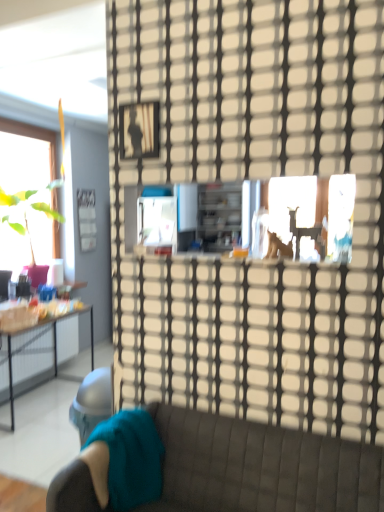
The height and width of the screenshot is (512, 384). Describe the element at coordinates (255, 178) in the screenshot. I see `transparent glass door at center` at that location.

Where is `velvet teal studio couch at lower left`? This screenshot has width=384, height=512. velvet teal studio couch at lower left is located at coordinates (260, 467).

At what (x,y) coordinates should I click in order to perform the action: click on teal fabric pillow at lower left. Please return your answer as a coordinate pair (x, y). The height and width of the screenshot is (512, 384). Looking at the image, I should click on (125, 460).

Is transparent glass door at center oriented towards velvet teal studio couch at lower left?

No, transparent glass door at center does not turn towards velvet teal studio couch at lower left.

Is transparent glass door at center in contact with velvet teal studio couch at lower left?

No, transparent glass door at center is not in contact with velvet teal studio couch at lower left.

Is point (195, 93) farther from camera compared to point (268, 459)?

Yes.

Is transparent glass door at center further to camera compared to velvet teal studio couch at lower left?

That is True.

From the image's perspective, which is above, velvet teal studio couch at lower left or teal fabric pillow at lower left?

From the image's view, teal fabric pillow at lower left is above.

Considering the sizes of objects velvet teal studio couch at lower left and teal fabric pillow at lower left in the image provided, who is bigger, velvet teal studio couch at lower left or teal fabric pillow at lower left?

velvet teal studio couch at lower left is bigger.

Between point (296, 510) and point (126, 416), which one is positioned behind?

The point (126, 416) is behind.

This screenshot has width=384, height=512. In order to click on studio couch lying on the right of teal fabric pillow at lower left in this screenshot , I will do `click(260, 467)`.

You are a GUI agent. You are given a task and a screenshot of the screen. Output one action in this format:
    pyautogui.click(x=<x>, y=<y>)
    Task: Click on the pillow on the left of metallic silver picture frame at upper center
    This screenshot has width=384, height=512.
    Given the screenshot: What is the action you would take?
    pyautogui.click(x=125, y=460)

Which is behind, point (159, 478) or point (139, 130)?

Positioned behind is point (139, 130).

From a real-world perspective, does teal fabric pillow at lower left sit lower than metallic silver picture frame at upper center?

Yes, from a real-world perspective, teal fabric pillow at lower left is below metallic silver picture frame at upper center.

From the image's perspective, is velvet teal studio couch at lower left on top of metallic silver picture frame at upper center?

No, from the image's perspective, velvet teal studio couch at lower left is not above metallic silver picture frame at upper center.

Is velvet teal studio couch at lower left wider or thinner than metallic silver picture frame at upper center?

Considering their sizes, velvet teal studio couch at lower left looks broader than metallic silver picture frame at upper center.

Is velvet teal studio couch at lower left looking in the opposite direction of metallic silver picture frame at upper center?

No, velvet teal studio couch at lower left's orientation is not away from metallic silver picture frame at upper center.

Considering the sizes of objects teal fabric pillow at lower left and velvet teal studio couch at lower left in the image provided, who is smaller, teal fabric pillow at lower left or velvet teal studio couch at lower left?

teal fabric pillow at lower left.

From the image's perspective, between teal fabric pillow at lower left and velvet teal studio couch at lower left, who is located below?

velvet teal studio couch at lower left appears lower in the image.

You are a GUI agent. You are given a task and a screenshot of the screen. Output one action in this format:
    pyautogui.click(x=<x>, y=<y>)
    Task: Click on the studio couch that appears in front of the teal fabric pillow at lower left
    
    Given the screenshot: What is the action you would take?
    pyautogui.click(x=260, y=467)

Can velvet teal studio couch at lower left be found inside teal fabric pillow at lower left?

No, velvet teal studio couch at lower left is not inside teal fabric pillow at lower left.

This screenshot has height=512, width=384. I want to click on pillow below the metallic silver picture frame at upper center (from the image's perspective), so click(125, 460).

Is metallic silver picture frame at upper center outside of teal fabric pillow at lower left?

Absolutely, metallic silver picture frame at upper center is external to teal fabric pillow at lower left.

Can you confirm if metallic silver picture frame at upper center is smaller than teal fabric pillow at lower left?

Indeed, metallic silver picture frame at upper center has a smaller size compared to teal fabric pillow at lower left.

Considering the points (127, 137) and (132, 455), which point is behind, point (127, 137) or point (132, 455)?

The point (127, 137) is behind.

Is point (150, 150) positioned in front of point (268, 112)?

No, it is behind (268, 112).

Is metallic silver picture frame at upper center placed right next to transparent glass door at center?

metallic silver picture frame at upper center is not next to transparent glass door at center, and they're not touching.

Considering the relative sizes of metallic silver picture frame at upper center and transparent glass door at center in the image provided, is metallic silver picture frame at upper center thinner than transparent glass door at center?

Correct, the width of metallic silver picture frame at upper center is less than that of transparent glass door at center.

In the scene shown: From a real-world perspective, which object rests below the other?

transparent glass door at center, from a real-world perspective.

I want to click on studio couch beneath the transparent glass door at center (from a real-world perspective), so click(x=260, y=467).

What are the coordinates of `studio couch in front of the teal fabric pillow at lower left` in the screenshot? It's located at (260, 467).

Based on the photo, estimate the real-world distances between objects in this image. Which object is further from teal fabric pillow at lower left, metallic silver picture frame at upper center or velvet teal studio couch at lower left?

metallic silver picture frame at upper center is positioned further to the anchor teal fabric pillow at lower left.

When comparing their distances from velvet teal studio couch at lower left, does teal fabric pillow at lower left or transparent glass door at center seem further?

Among the two, transparent glass door at center is located further to velvet teal studio couch at lower left.

Based on the photo, based on their spatial positions, is velvet teal studio couch at lower left or transparent glass door at center further from metallic silver picture frame at upper center?

Based on the image, velvet teal studio couch at lower left appears to be further to metallic silver picture frame at upper center.

Based on their spatial positions, is teal fabric pillow at lower left or transparent glass door at center closer to metallic silver picture frame at upper center?

transparent glass door at center lies closer to metallic silver picture frame at upper center than the other object.

Estimate the real-world distances between objects in this image. Which object is further from metallic silver picture frame at upper center, teal fabric pillow at lower left or velvet teal studio couch at lower left?

Based on the image, velvet teal studio couch at lower left appears to be further to metallic silver picture frame at upper center.

Looking at the image, which one is located further to teal fabric pillow at lower left, metallic silver picture frame at upper center or transparent glass door at center?

metallic silver picture frame at upper center.

Based on their spatial positions, is velvet teal studio couch at lower left or teal fabric pillow at lower left further from transparent glass door at center?

Among the two, teal fabric pillow at lower left is located further to transparent glass door at center.

Which object lies nearer to the anchor point transparent glass door at center, metallic silver picture frame at upper center or velvet teal studio couch at lower left?

metallic silver picture frame at upper center is closer to transparent glass door at center.

Image resolution: width=384 pixels, height=512 pixels. In order to click on glass door between metallic silver picture frame at upper center and velvet teal studio couch at lower left in the vertical direction in this screenshot , I will do `click(255, 178)`.

Identify the location of pillow between transparent glass door at center and velvet teal studio couch at lower left from top to bottom. click(125, 460).

The height and width of the screenshot is (512, 384). What are the coordinates of `pillow between metallic silver picture frame at upper center and velvet teal studio couch at lower left vertically` in the screenshot? It's located at (125, 460).

Where is `glass door between metallic silver picture frame at upper center and teal fabric pillow at lower left vertically`? glass door between metallic silver picture frame at upper center and teal fabric pillow at lower left vertically is located at coordinates (255, 178).